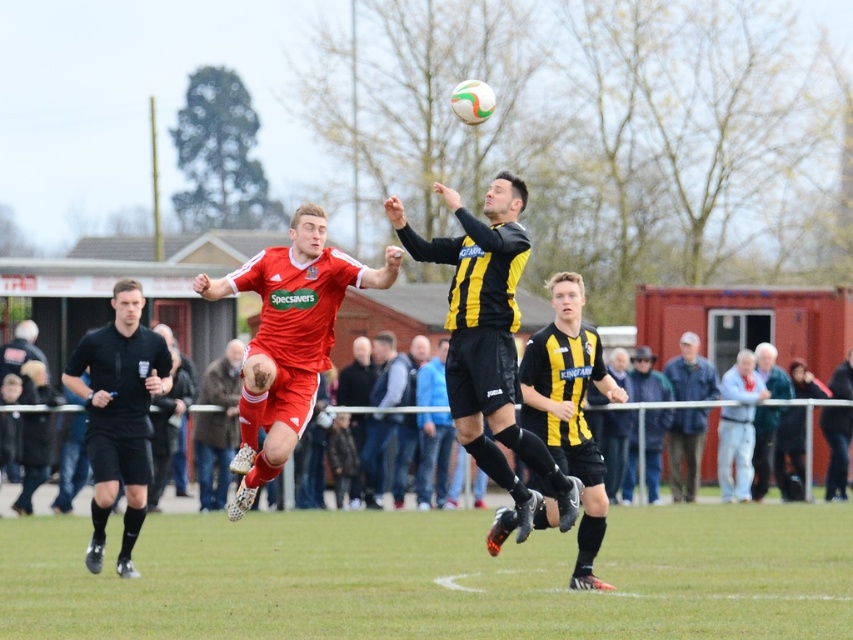
You are a photographer standing at the edge of the soccer field. You want to take a photo of the black leather jacket at center and the blue denim jacket at lower right. Which jacket will appear closer to the camera in the photo?

The blue denim jacket at lower right will appear closer to the camera in the photo because it is further to the viewer than the black leather jacket at center.

You are a photographer at the soccer field and want to capture both the blue denim jacket at lower right and the black leather jacket at center in a single frame. Which jacket will appear smaller in the photo?

The blue denim jacket at lower right will appear smaller in the photo because it occupies less space than the black leather jacket at center.

You are a soccer referee observing the match. You notice two players, the black jersey at center and the blue jersey at center, involved in a header. Based on their positions, which player is more likely to have control of the ball?

The black jersey at center is positioned over the blue jersey at center, so the black jersey at center is more likely to have control of the ball.